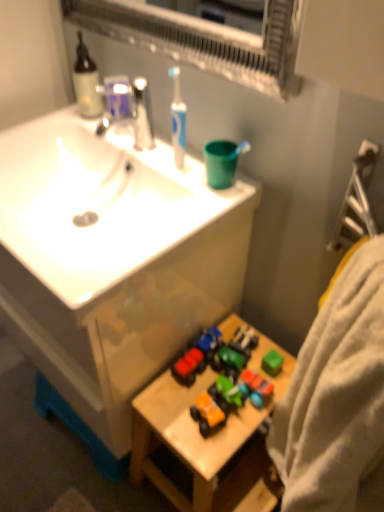
Question: In terms of size, does matte silver faucet at upper center appear bigger or smaller than matte plastic toy car at center, which appears as the first toy when viewed from the left?

Choices:
 (A) small
 (B) big

Answer: (B)

Question: From their relative heights in the image, would you say matte silver faucet at upper center is taller or shorter than matte plastic toy car at center, the fourth toy from the right?

Choices:
 (A) tall
 (B) short

Answer: (A)

Question: Which of these objects is positioned farthest from the matte silver faucet at upper center?

Choices:
 (A) matte plastic toy car at center, the fourth toy from the right
 (B) white soft towel at right
 (C) orange matte toy car at lower center, which appears as the second toy when viewed from the left
 (D) green matte toy car at lower center, the first toy from the right
 (E) white glossy sink at upper left

Answer: (B)

Question: Which is nearer to the rubberized plastic toy car at center, which ranks as the 3th toy in left-to-right order?

Choices:
 (A) translucent glass soap dispenser at upper left
 (B) matte silver faucet at upper center
 (C) white glossy sink at upper left
 (D) green matte toy car at lower center, the first toy from the right
 (E) wooden toy at lower right

Answer: (D)